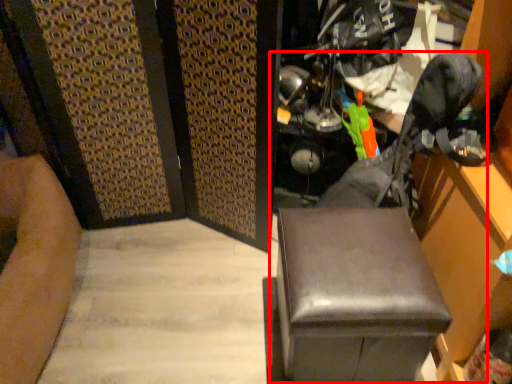
Question: From the image's perspective, what is the correct spatial positioning of swivel chair (annotated by the red box) in reference to furniture?

Choices:
 (A) below
 (B) above

Answer: (B)